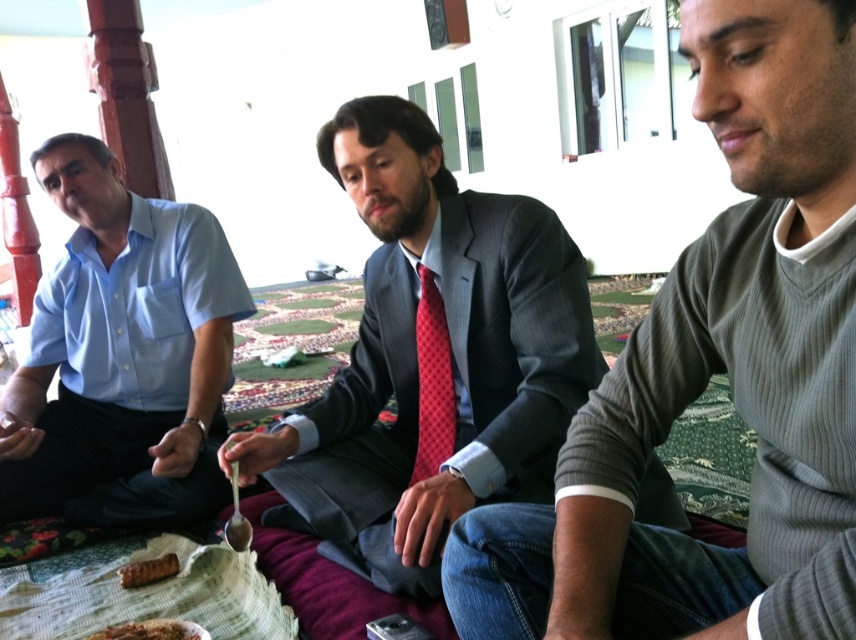
Does gray ribbed sweater at center have a smaller size compared to brown crispy pastry at lower left?

Actually, gray ribbed sweater at center might be larger than brown crispy pastry at lower left.

Is gray ribbed sweater at center positioned behind brown crispy pastry at lower left?

No, gray ribbed sweater at center is in front of brown crispy pastry at lower left.

Is point (801, 273) positioned after point (137, 584)?

No, (801, 273) is closer to viewer.

Where is `gray ribbed sweater at center`? Image resolution: width=856 pixels, height=640 pixels. gray ribbed sweater at center is located at coordinates (711, 374).

Is matte gray suit at center shorter than red dotted tie at center?

In fact, matte gray suit at center may be taller than red dotted tie at center.

Between point (438, 202) and point (421, 477), which one is positioned behind?

Point (421, 477)

Which is in front, point (409, 362) or point (409, 481)?

Point (409, 362) is in front.

Locate an element on the screen. This screenshot has height=640, width=856. matte gray suit at center is located at coordinates (431, 358).

How far apart are gray ribbed sweater at center and matte gray suit at center?

gray ribbed sweater at center and matte gray suit at center are 20.48 inches apart.

Which is behind, point (704, 307) or point (382, 378)?

Positioned behind is point (382, 378).

Locate an element on the screen. gray ribbed sweater at center is located at coordinates (711, 374).